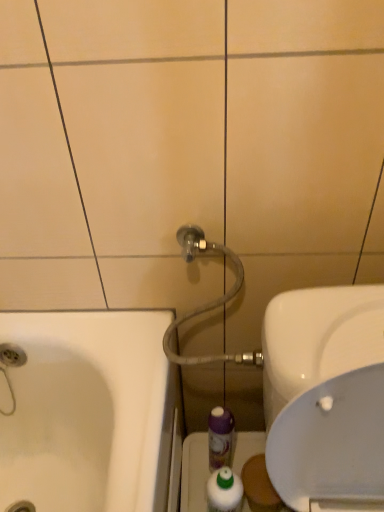
Where is `purple plastic mouthwash at center, the 2th mouthwash viewed from the front`? purple plastic mouthwash at center, the 2th mouthwash viewed from the front is located at coordinates (220, 437).

Locate an element on the screen. white glossy sink at right is located at coordinates (325, 393).

The image size is (384, 512). Describe the element at coordinates (194, 473) in the screenshot. I see `transparent plastic bottle at lower center` at that location.

I want to click on purple plastic mouthwash at center, the 2th mouthwash viewed from the front, so click(x=220, y=437).

Is white glossy mouthwash at lower center, the 1th mouthwash viewed from the front, inside the boundaries of matte gray hose at upper center, or outside?

white glossy mouthwash at lower center, the 1th mouthwash viewed from the front, cannot be found inside matte gray hose at upper center.

Can you confirm if white glossy mouthwash at lower center, the 2th mouthwash positioned from the back, is shorter than matte gray hose at upper center?

Yes, white glossy mouthwash at lower center, the 2th mouthwash positioned from the back, is shorter than matte gray hose at upper center.

Is white glossy mouthwash at lower center, the 2th mouthwash positioned from the back, further to the viewer compared to matte gray hose at upper center?

That is True.

Is white glossy mouthwash at lower center, the 1th mouthwash viewed from the front, turned away from matte gray hose at upper center?

white glossy mouthwash at lower center, the 1th mouthwash viewed from the front, does not have its back to matte gray hose at upper center.

Are white glossy mouthwash at lower center, the 2th mouthwash positioned from the back, and purple plastic mouthwash at center, which is the 1th mouthwash from back to front, located far from each other?

white glossy mouthwash at lower center, the 2th mouthwash positioned from the back, is near purple plastic mouthwash at center, which is the 1th mouthwash from back to front, not far away.

In order to click on mouthwash in front of the purple plastic mouthwash at center, which is the 1th mouthwash from back to front in this screenshot , I will do `click(224, 490)`.

Between white glossy mouthwash at lower center, the 1th mouthwash viewed from the front, and purple plastic mouthwash at center, which is the 1th mouthwash from back to front, which one has more height?

Standing taller between the two is purple plastic mouthwash at center, which is the 1th mouthwash from back to front.

In the scene shown: Is white glossy mouthwash at lower center, the 2th mouthwash positioned from the back, inside the boundaries of purple plastic mouthwash at center, which is the 1th mouthwash from back to front, or outside?

white glossy mouthwash at lower center, the 2th mouthwash positioned from the back, exists outside the volume of purple plastic mouthwash at center, which is the 1th mouthwash from back to front.

At what (x,y) coordinates should I click in order to perform the action: click on mouthwash below the purple plastic mouthwash at center, the 2th mouthwash viewed from the front (from the image's perspective). Please return your answer as a coordinate pair (x, y). The image size is (384, 512). Looking at the image, I should click on (224, 490).

Is purple plastic mouthwash at center, the 2th mouthwash viewed from the front, not near white glossy mouthwash at lower center, the 2th mouthwash positioned from the back?

They are positioned close to each other.

Is purple plastic mouthwash at center, the 2th mouthwash viewed from the front, inside the boundaries of white glossy mouthwash at lower center, the 1th mouthwash viewed from the front, or outside?

The correct answer is: outside.

Consider the image. Between matte gray hose at upper center and purple plastic mouthwash at center, which is the 1th mouthwash from back to front, which one has larger size?

Bigger between the two is matte gray hose at upper center.

Is matte gray hose at upper center at the left side of purple plastic mouthwash at center, the 2th mouthwash viewed from the front?

Indeed, matte gray hose at upper center is positioned on the left side of purple plastic mouthwash at center, the 2th mouthwash viewed from the front.

Based on the photo, would you say matte gray hose at upper center is inside or outside purple plastic mouthwash at center, the 2th mouthwash viewed from the front?

matte gray hose at upper center is outside purple plastic mouthwash at center, the 2th mouthwash viewed from the front.

Does matte gray hose at upper center come in front of purple plastic mouthwash at center, which is the 1th mouthwash from back to front?

Yes, the depth of matte gray hose at upper center is less than that of purple plastic mouthwash at center, which is the 1th mouthwash from back to front.

From the image's perspective, is white glossy sink at right located above or below white glossy mouthwash at lower center, the 1th mouthwash viewed from the front?

Clearly, from the image's perspective, white glossy sink at right is above white glossy mouthwash at lower center, the 1th mouthwash viewed from the front.

Considering the sizes of white glossy sink at right and white glossy mouthwash at lower center, the 1th mouthwash viewed from the front, in the image, is white glossy sink at right taller or shorter than white glossy mouthwash at lower center, the 1th mouthwash viewed from the front,?

Considering their sizes, white glossy sink at right has more height than white glossy mouthwash at lower center, the 1th mouthwash viewed from the front.

The height and width of the screenshot is (512, 384). I want to click on porcelain below the white glossy sink at right (from the image's perspective), so (194, 473).

Is white glossy sink at right closer to camera compared to transparent plastic bottle at lower center?

Yes, white glossy sink at right is closer to the camera.

Consider the image. Is white glossy sink at right taller or shorter than transparent plastic bottle at lower center?

In the image, white glossy sink at right appears to be taller than transparent plastic bottle at lower center.

Does white glossy sink at right have a smaller size compared to transparent plastic bottle at lower center?

Incorrect, white glossy sink at right is not smaller in size than transparent plastic bottle at lower center.

Considering the positions of objects white glossy mouthwash at lower center, the 2th mouthwash positioned from the back, and transparent plastic bottle at lower center in the image provided, who is more to the right, white glossy mouthwash at lower center, the 2th mouthwash positioned from the back, or transparent plastic bottle at lower center?

transparent plastic bottle at lower center is more to the right.

Based on the photo, from the image's perspective, is white glossy mouthwash at lower center, the 2th mouthwash positioned from the back, located beneath transparent plastic bottle at lower center?

Incorrect, from the image's perspective, white glossy mouthwash at lower center, the 2th mouthwash positioned from the back, is higher than transparent plastic bottle at lower center.

Is white glossy mouthwash at lower center, the 2th mouthwash positioned from the back, positioned with its back to transparent plastic bottle at lower center?

No, white glossy mouthwash at lower center, the 2th mouthwash positioned from the back,'s orientation is not away from transparent plastic bottle at lower center.

At what (x,y) coordinates should I click in order to perform the action: click on shower located above the white glossy mouthwash at lower center, the 1th mouthwash viewed from the front (from a real-world perspective). Please return your answer as a coordinate pair (x, y). Looking at the image, I should click on (209, 302).

This screenshot has width=384, height=512. What are the coordinates of `mouthwash above the white glossy mouthwash at lower center, the 2th mouthwash positioned from the back (from the image's perspective)` in the screenshot? It's located at (220, 437).

Looking at the image, which one is located closer to transparent plastic bottle at lower center, white glossy sink at right or matte gray hose at upper center?

Among the two, matte gray hose at upper center is located nearer to transparent plastic bottle at lower center.

Looking at the image, which one is located closer to matte gray hose at upper center, white glossy sink at right or transparent plastic bottle at lower center?

transparent plastic bottle at lower center is closer to matte gray hose at upper center.

From the image, which object appears to be farther from purple plastic mouthwash at center, which is the 1th mouthwash from back to front, transparent plastic bottle at lower center or white glossy mouthwash at lower center, the 1th mouthwash viewed from the front?

Among the two, transparent plastic bottle at lower center is located further to purple plastic mouthwash at center, which is the 1th mouthwash from back to front.

Looking at this image, when comparing their distances from white glossy sink at right, does matte gray hose at upper center or transparent plastic bottle at lower center seem further?

transparent plastic bottle at lower center is further to white glossy sink at right.

Estimate the real-world distances between objects in this image. Which object is closer to matte gray hose at upper center, white glossy mouthwash at lower center, the 2th mouthwash positioned from the back, or transparent plastic bottle at lower center?

transparent plastic bottle at lower center is closer to matte gray hose at upper center.

Considering their positions, is purple plastic mouthwash at center, which is the 1th mouthwash from back to front, positioned closer to white glossy mouthwash at lower center, the 2th mouthwash positioned from the back, than transparent plastic bottle at lower center?

purple plastic mouthwash at center, which is the 1th mouthwash from back to front, lies closer to white glossy mouthwash at lower center, the 2th mouthwash positioned from the back, than the other object.

From the picture: When comparing their distances from matte gray hose at upper center, does purple plastic mouthwash at center, which is the 1th mouthwash from back to front, or transparent plastic bottle at lower center seem closer?

The object closer to matte gray hose at upper center is purple plastic mouthwash at center, which is the 1th mouthwash from back to front.

Estimate the real-world distances between objects in this image. Which object is further from white glossy sink at right, white glossy mouthwash at lower center, the 2th mouthwash positioned from the back, or matte gray hose at upper center?

white glossy mouthwash at lower center, the 2th mouthwash positioned from the back, lies further to white glossy sink at right than the other object.

Find the location of a particular element. The height and width of the screenshot is (512, 384). mouthwash positioned between white glossy mouthwash at lower center, the 1th mouthwash viewed from the front, and transparent plastic bottle at lower center from near to far is located at coordinates (220, 437).

Where is `shower between white glossy sink at right and purple plastic mouthwash at center, the 2th mouthwash viewed from the front, from front to back`? shower between white glossy sink at right and purple plastic mouthwash at center, the 2th mouthwash viewed from the front, from front to back is located at coordinates (209, 302).

Identify the location of shower between white glossy sink at right and white glossy mouthwash at lower center, the 2th mouthwash positioned from the back, along the z-axis. (209, 302).

Identify the location of shower between white glossy sink at right and transparent plastic bottle at lower center along the z-axis. The height and width of the screenshot is (512, 384). (209, 302).